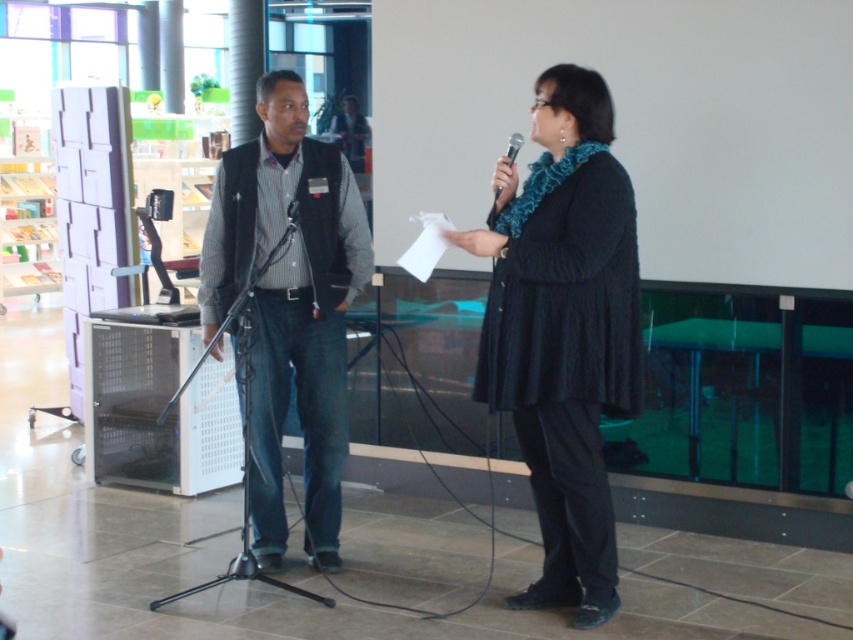
In the scene shown: You are organizing a small event and need to place a 1.2 meter wide decorative banner between the black knitted sweater at center and the matte black vest at center. Will the banner fit between them?

The distance between the black knitted sweater at center and the matte black vest at center is 1.13 meters. Since the banner is 1.2 meters wide, it will not fit between them as the space is narrower than the banner.